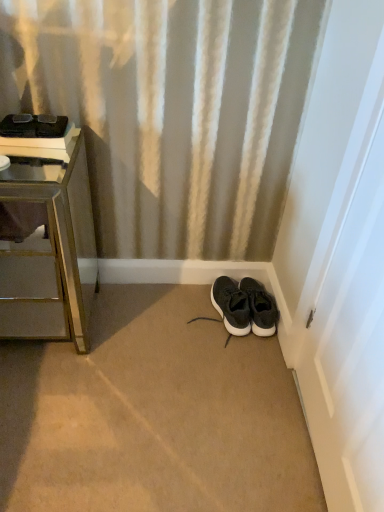
How much space does black fabric sneakers at center, acting as the 2th footwear starting from the right, occupy vertically?

black fabric sneakers at center, acting as the 2th footwear starting from the right, is 4.87 inches tall.

In order to face white glossy door at right, should I rotate leftwards or rightwards?

A 22.225 degree turn to the right will do.

Image resolution: width=384 pixels, height=512 pixels. Find the location of `white glossy door at right`. white glossy door at right is located at coordinates (340, 258).

Identify the location of brushed metal nightstand at left. (50, 247).

This screenshot has width=384, height=512. What do you see at coordinates (260, 308) in the screenshot? I see `black suede sneakers at lower right, which is counted as the 1th footwear, starting from the right` at bounding box center [260, 308].

Identify the location of black fabric sneakers at center, the first footwear viewed from the left. (231, 306).

Is the surface of white glossy door at right in direct contact with brushed metal nightstand at left?

They are not placed beside each other.

Which object is thinner, white glossy door at right or brushed metal nightstand at left?

white glossy door at right.

What's the angular difference between white glossy door at right and brushed metal nightstand at left's facing directions?

89.7 degrees.

From a real-world perspective, which is physically below, white glossy door at right or brushed metal nightstand at left?

brushed metal nightstand at left, from a real-world perspective.

Which is more to the right, black fabric sneakers at center, the first footwear viewed from the left, or white glossy door at right?

white glossy door at right is more to the right.

Looking at their sizes, would you say black fabric sneakers at center, acting as the 2th footwear starting from the right, is wider or thinner than white glossy door at right?

Clearly, black fabric sneakers at center, acting as the 2th footwear starting from the right, has more width compared to white glossy door at right.

Is black fabric sneakers at center, the first footwear viewed from the left, bigger than white glossy door at right?

No, black fabric sneakers at center, the first footwear viewed from the left, is not bigger than white glossy door at right.

Considering the positions of point (236, 293) and point (302, 397), is point (236, 293) closer or farther from the camera than point (302, 397)?

Point (236, 293).

Looking at their sizes, would you say black suede sneakers at lower right, which is counted as the 1th footwear, starting from the right, is wider or thinner than white glossy door at right?

Considering their sizes, black suede sneakers at lower right, which is counted as the 1th footwear, starting from the right, looks broader than white glossy door at right.

In terms of height, does black suede sneakers at lower right, the second footwear when ordered from left to right, look taller or shorter compared to white glossy door at right?

In the image, black suede sneakers at lower right, the second footwear when ordered from left to right, appears to be shorter than white glossy door at right.

From the white glossy door at right, count 2nd footwears backward and point to it. Please provide its 2D coordinates.

[(260, 308)]

Is black suede sneakers at lower right, which is counted as the 1th footwear, starting from the right, looking in the opposite direction of white glossy door at right?

No, black suede sneakers at lower right, which is counted as the 1th footwear, starting from the right, is not facing the opposite direction of white glossy door at right.

From a real-world perspective, is black suede sneakers at lower right, the second footwear when ordered from left to right, positioned over black fabric sneakers at center, the first footwear viewed from the left, based on gravity?

Incorrect, from a real-world perspective, black suede sneakers at lower right, the second footwear when ordered from left to right, is lower than black fabric sneakers at center, the first footwear viewed from the left.

The height and width of the screenshot is (512, 384). I want to click on footwear lying behind the black fabric sneakers at center, the first footwear viewed from the left, so click(x=260, y=308).

Looking at this image, is black suede sneakers at lower right, the second footwear when ordered from left to right, looking in the opposite direction of black fabric sneakers at center, acting as the 2th footwear starting from the right?

No, black suede sneakers at lower right, the second footwear when ordered from left to right, is not facing away from black fabric sneakers at center, acting as the 2th footwear starting from the right.

From the image's perspective, would you say black suede sneakers at lower right, the second footwear when ordered from left to right, is positioned over black fabric sneakers at center, the first footwear viewed from the left?

Result: Actually, black suede sneakers at lower right, the second footwear when ordered from left to right, appears below black fabric sneakers at center, the first footwear viewed from the left, in the image.

Considering the relative sizes of brushed metal nightstand at left and black fabric sneakers at center, acting as the 2th footwear starting from the right, in the image provided, is brushed metal nightstand at left taller than black fabric sneakers at center, acting as the 2th footwear starting from the right,?

Indeed, brushed metal nightstand at left has a greater height compared to black fabric sneakers at center, acting as the 2th footwear starting from the right.

Considering the positions of objects brushed metal nightstand at left and black fabric sneakers at center, acting as the 2th footwear starting from the right, in the image provided, who is behind, brushed metal nightstand at left or black fabric sneakers at center, acting as the 2th footwear starting from the right,?

black fabric sneakers at center, acting as the 2th footwear starting from the right, is further away from the camera.

From a real-world perspective, does brushed metal nightstand at left sit lower than black fabric sneakers at center, acting as the 2th footwear starting from the right?

No, from a real-world perspective, brushed metal nightstand at left is not below black fabric sneakers at center, acting as the 2th footwear starting from the right.

From a real-world perspective, starting from the brushed metal nightstand at left, which footwear is the 1st one below it? Please provide its 2D coordinates.

[(231, 306)]

Considering the sizes of black fabric sneakers at center, acting as the 2th footwear starting from the right, and black suede sneakers at lower right, which is counted as the 1th footwear, starting from the right, in the image, is black fabric sneakers at center, acting as the 2th footwear starting from the right, taller or shorter than black suede sneakers at lower right, which is counted as the 1th footwear, starting from the right,?

Considering their sizes, black fabric sneakers at center, acting as the 2th footwear starting from the right, has less height than black suede sneakers at lower right, which is counted as the 1th footwear, starting from the right.

Considering the relative sizes of black fabric sneakers at center, the first footwear viewed from the left, and black suede sneakers at lower right, the second footwear when ordered from left to right, in the image provided, is black fabric sneakers at center, the first footwear viewed from the left, bigger than black suede sneakers at lower right, the second footwear when ordered from left to right,?

Yes.

Between black fabric sneakers at center, acting as the 2th footwear starting from the right, and black suede sneakers at lower right, the second footwear when ordered from left to right, which one appears on the left side from the viewer's perspective?

black fabric sneakers at center, acting as the 2th footwear starting from the right.

Are black fabric sneakers at center, acting as the 2th footwear starting from the right, and black suede sneakers at lower right, which is counted as the 1th footwear, starting from the right, far apart?

No, black fabric sneakers at center, acting as the 2th footwear starting from the right, is in close proximity to black suede sneakers at lower right, which is counted as the 1th footwear, starting from the right.

Is black suede sneakers at lower right, the second footwear when ordered from left to right, aimed at brushed metal nightstand at left?

No, black suede sneakers at lower right, the second footwear when ordered from left to right, is not turned towards brushed metal nightstand at left.

Between black suede sneakers at lower right, which is counted as the 1th footwear, starting from the right, and brushed metal nightstand at left, which one has more height?

brushed metal nightstand at left.

From a real-world perspective, between black suede sneakers at lower right, the second footwear when ordered from left to right, and brushed metal nightstand at left, who is vertically lower?

In real-world perspective, black suede sneakers at lower right, the second footwear when ordered from left to right, is lower.

Could brushed metal nightstand at left be considered to be inside black suede sneakers at lower right, which is counted as the 1th footwear, starting from the right?

No, brushed metal nightstand at left is not inside black suede sneakers at lower right, which is counted as the 1th footwear, starting from the right.

I want to click on screen door that is on the right side of brushed metal nightstand at left, so click(340, 258).

You are a GUI agent. You are given a task and a screenshot of the screen. Output one action in this format:
    pyautogui.click(x=<x>, y=<y>)
    Task: Click on the footwear that is the 2nd one when counting leftward from the white glossy door at right
    
    Given the screenshot: What is the action you would take?
    pyautogui.click(x=231, y=306)

From the picture: When comparing their distances from white glossy door at right, does black fabric sneakers at center, acting as the 2th footwear starting from the right, or black suede sneakers at lower right, which is counted as the 1th footwear, starting from the right, seem closer?

The object closer to white glossy door at right is black suede sneakers at lower right, which is counted as the 1th footwear, starting from the right.

Based on their spatial positions, is black fabric sneakers at center, acting as the 2th footwear starting from the right, or black suede sneakers at lower right, the second footwear when ordered from left to right, closer to brushed metal nightstand at left?

Among the two, black fabric sneakers at center, acting as the 2th footwear starting from the right, is located nearer to brushed metal nightstand at left.

Based on their spatial positions, is black suede sneakers at lower right, which is counted as the 1th footwear, starting from the right, or brushed metal nightstand at left closer to white glossy door at right?

black suede sneakers at lower right, which is counted as the 1th footwear, starting from the right, is closer to white glossy door at right.

Which object lies nearer to the anchor point white glossy door at right, black fabric sneakers at center, the first footwear viewed from the left, or brushed metal nightstand at left?

Among the two, black fabric sneakers at center, the first footwear viewed from the left, is located nearer to white glossy door at right.

Based on their spatial positions, is white glossy door at right or black suede sneakers at lower right, which is counted as the 1th footwear, starting from the right, closer to brushed metal nightstand at left?

black suede sneakers at lower right, which is counted as the 1th footwear, starting from the right.

Which object lies further to the anchor point black fabric sneakers at center, the first footwear viewed from the left, brushed metal nightstand at left or white glossy door at right?

brushed metal nightstand at left lies further to black fabric sneakers at center, the first footwear viewed from the left, than the other object.

Based on their spatial positions, is black suede sneakers at lower right, the second footwear when ordered from left to right, or black fabric sneakers at center, acting as the 2th footwear starting from the right, further from brushed metal nightstand at left?

The object further to brushed metal nightstand at left is black suede sneakers at lower right, the second footwear when ordered from left to right.

Estimate the real-world distances between objects in this image. Which object is further from black suede sneakers at lower right, which is counted as the 1th footwear, starting from the right, black fabric sneakers at center, the first footwear viewed from the left, or brushed metal nightstand at left?

Based on the image, brushed metal nightstand at left appears to be further to black suede sneakers at lower right, which is counted as the 1th footwear, starting from the right.

The width and height of the screenshot is (384, 512). In order to click on furniture between white glossy door at right and black suede sneakers at lower right, the second footwear when ordered from left to right, in the front-back direction in this screenshot , I will do `click(50, 247)`.

At what (x,y) coordinates should I click in order to perform the action: click on furniture between white glossy door at right and black fabric sneakers at center, acting as the 2th footwear starting from the right, in the front-back direction. Please return your answer as a coordinate pair (x, y). Looking at the image, I should click on (50, 247).

In order to click on footwear situated between brushed metal nightstand at left and black suede sneakers at lower right, which is counted as the 1th footwear, starting from the right, from left to right in this screenshot , I will do `click(231, 306)`.

The image size is (384, 512). Find the location of `footwear between white glossy door at right and black suede sneakers at lower right, the second footwear when ordered from left to right, in the front-back direction`. footwear between white glossy door at right and black suede sneakers at lower right, the second footwear when ordered from left to right, in the front-back direction is located at coordinates (231, 306).